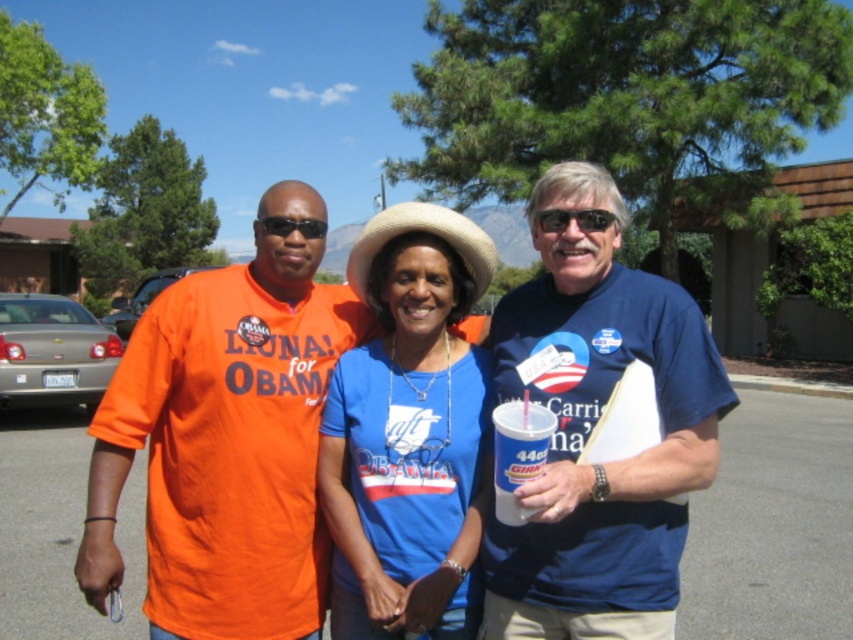
You are standing at the point marked by coordinates point (695, 392). You want to walk to the person on the left wearing an orange shirt with LIONA! for OBAMA. Which direction should you go?

The person on the left wearing an orange shirt with LIONA! for OBAMA is 2.02 meters away from the point (695, 392). To reach them, you should walk towards the left direction.

You are a photographer trying to capture a group photo of the three people in the scene. The orange cotton shirt at left and the natural straw cowboy hat at center are important elements. Considering their sizes, which object should you focus on to ensure it fits entirely within the camera frame if the frame can only accommodate the size of the smaller object?

The orange cotton shirt at left is larger than the natural straw cowboy hat at center. To ensure the smaller object fits entirely within the camera frame, you should focus on the natural straw cowboy hat at center since it is smaller and will fit within the frame designed for the smaller object.

You are a photographer trying to capture a clear shot of the blue cotton shirt at center and the gray asphalt parking lot at center. Which object is positioned closer to the camera?

The blue cotton shirt at center is closer to the viewer than the gray asphalt parking lot at center, so it will appear in front of the parking lot in the photo.